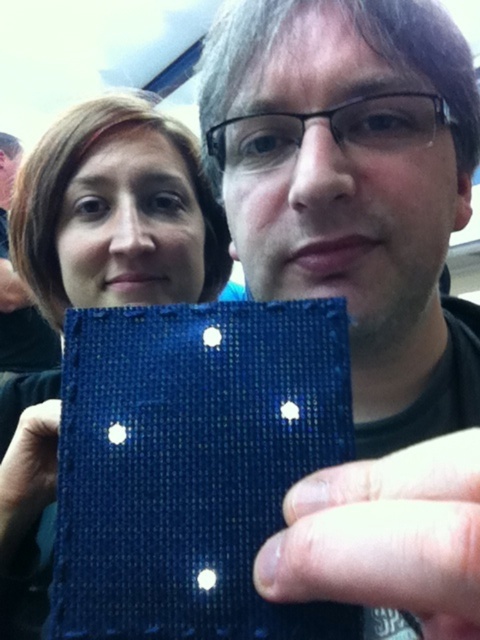
You are holding a camera and want to take a selfie with two people. The point where you are standing is at coordinates point (186, 164). If the recommended distance between the camera and the subject is 30 inches, is your current position suitable for taking the selfie?

The distance between point (186, 164) and the camera is 30.92 inches, which is slightly more than the recommended 30 inches. However, it is close enough for a suitable selfie.